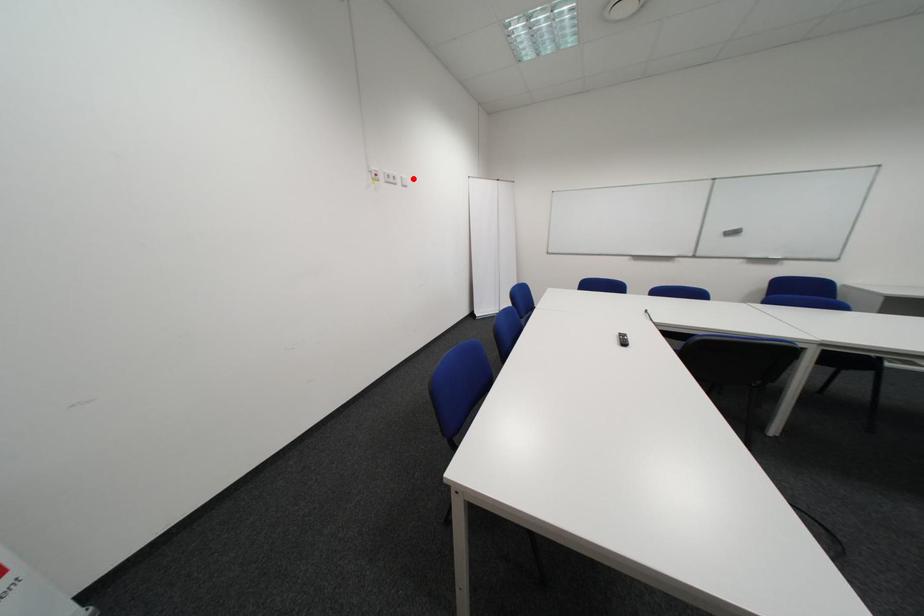
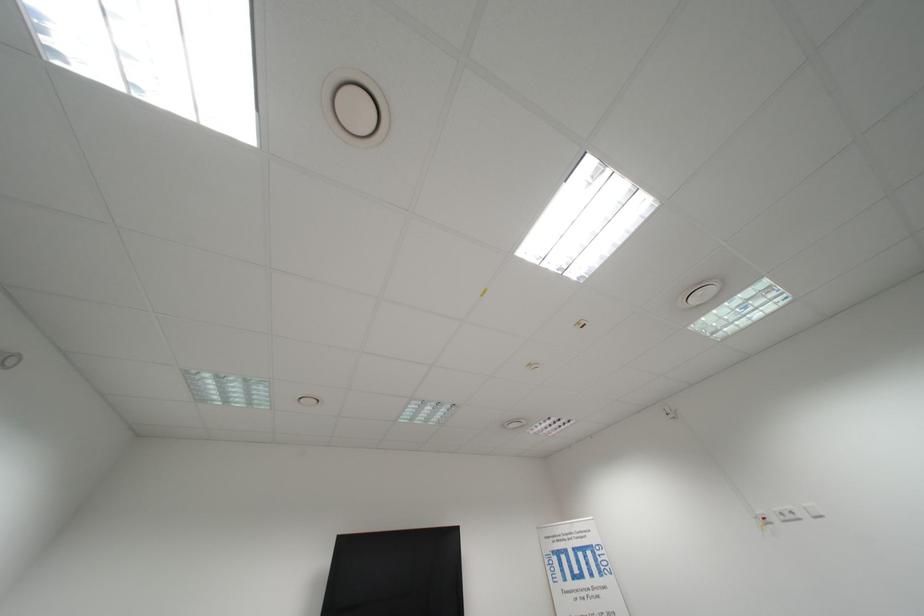
In the second image, find the point that corresponds to the highlighted location in the first image.

(818, 509)